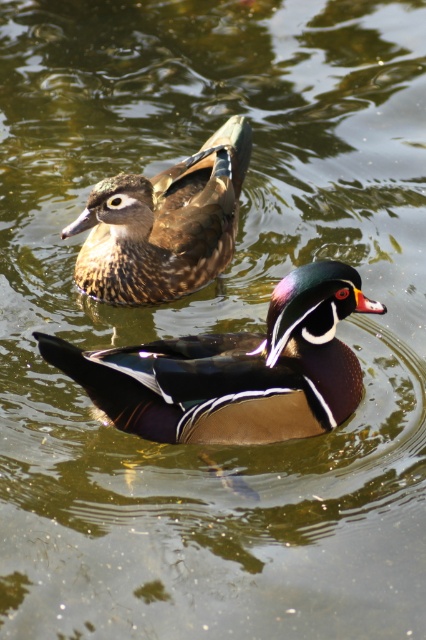
Can you confirm if shiny brown duck at center is wider than brown speckled wood duck at upper left?

Yes.

In the scene shown: Is shiny brown duck at center bigger than brown speckled wood duck at upper left?

No.

Is point (267, 353) more distant than point (183, 196)?

That is False.

This screenshot has width=426, height=640. I want to click on shiny brown duck at center, so click(235, 371).